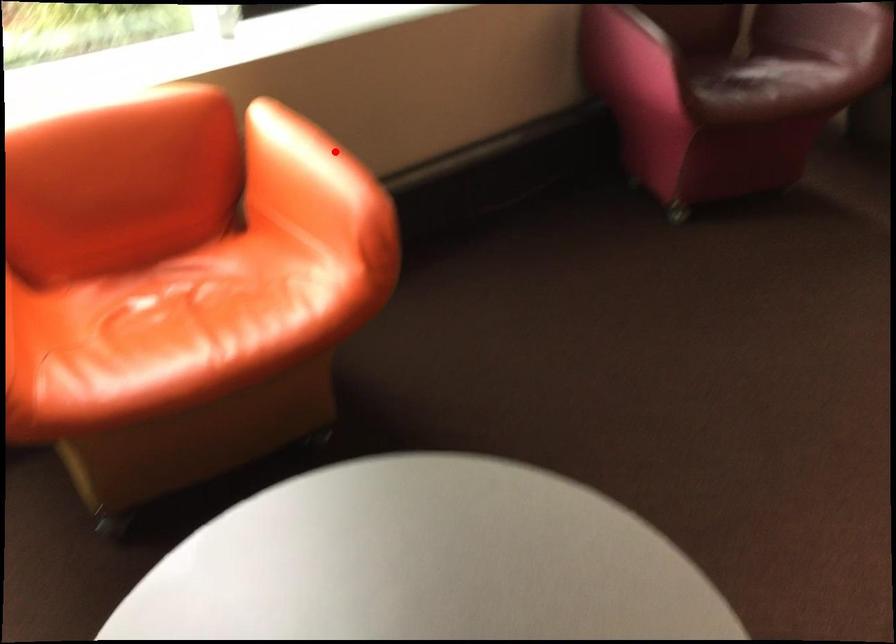
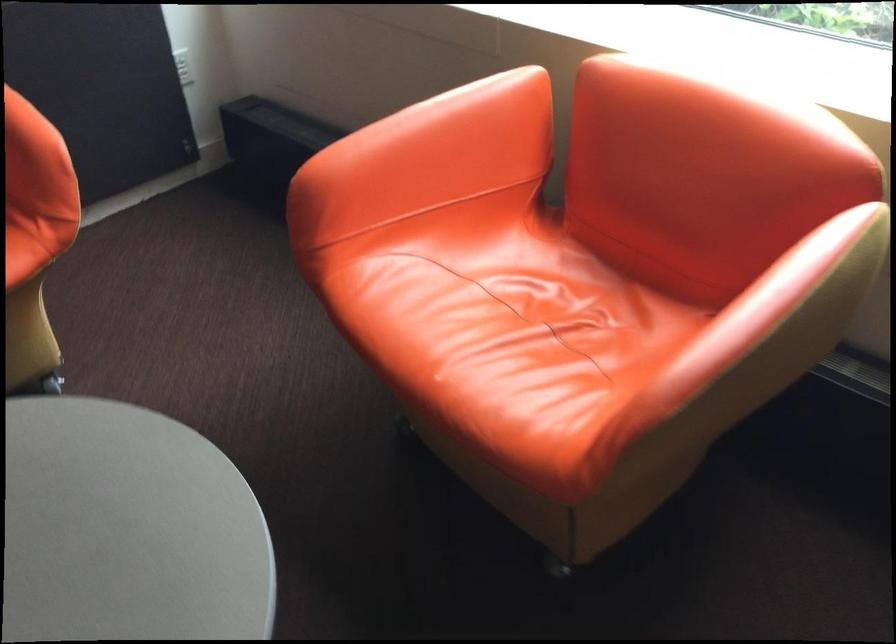
Locate, in the second image, the point that corresponds to the highlighted location in the first image.

(794, 323)